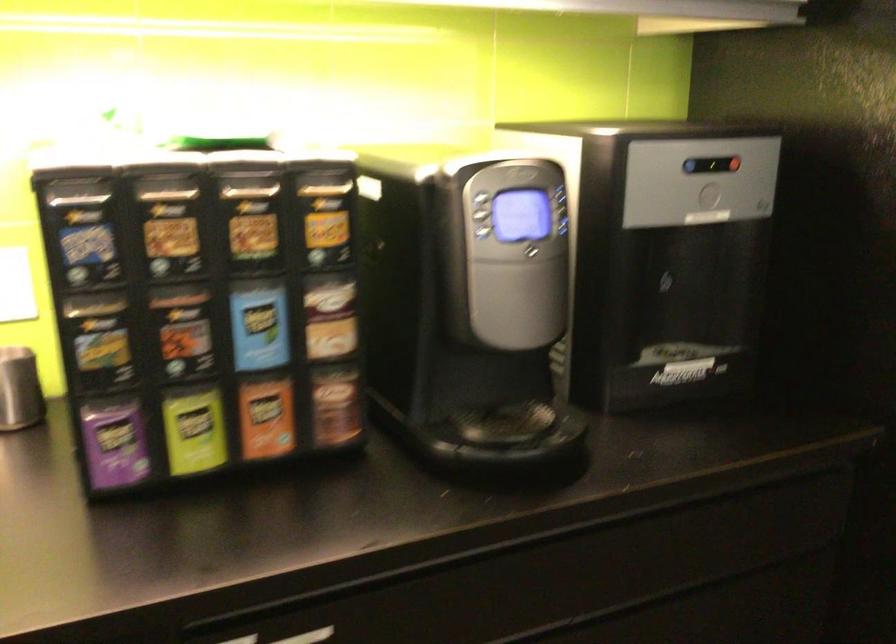
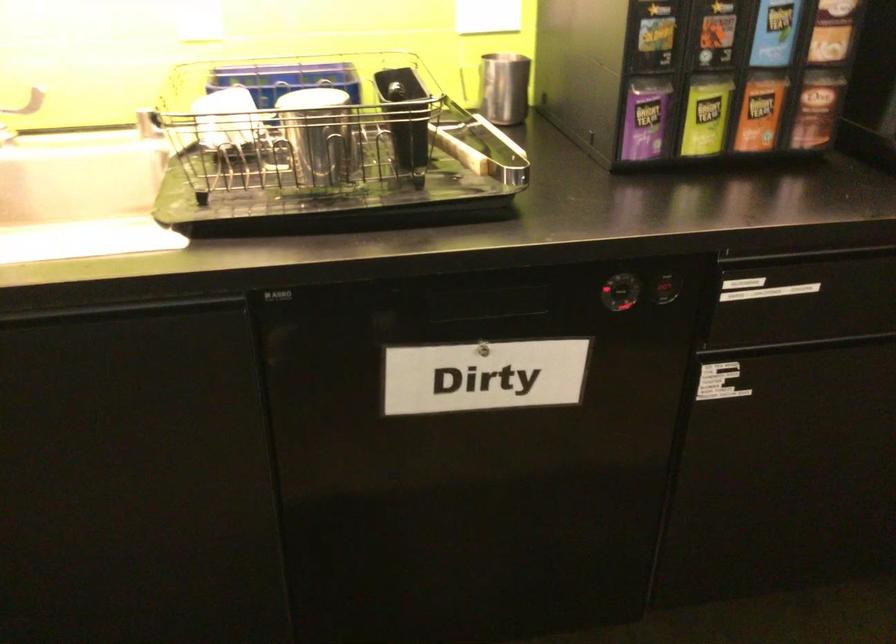
Where in the second image is the point corresponding to point (332, 406) from the first image?

(816, 109)